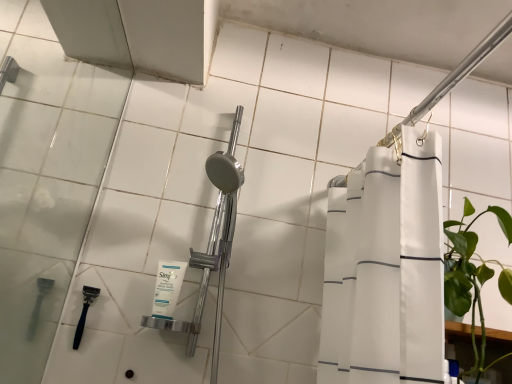
Question: Relative to white fabric shower curtain at upper right, placed as the 1th shower when sorted from front to back, is white matte facial cleanser at center in front or behind?

Choices:
 (A) front
 (B) behind

Answer: (B)

Question: From a real-world perspective, is white matte facial cleanser at center positioned above or below white fabric shower curtain at upper right, placed as the second shower when sorted from bottom to top?

Choices:
 (A) above
 (B) below

Answer: (B)

Question: Which is nearer to the white matte facial cleanser at center?

Choices:
 (A) black plastic razor at lower left, positioned as the second shower in front-to-back order
 (B) white fabric shower curtain at upper right, placed as the second shower when sorted from bottom to top

Answer: (A)

Question: Considering the real-world distances, which object is closest to the black plastic razor at lower left, which is the first shower from bottom to top?

Choices:
 (A) white matte facial cleanser at center
 (B) white fabric shower curtain at upper right, arranged as the second shower when viewed from the left

Answer: (A)